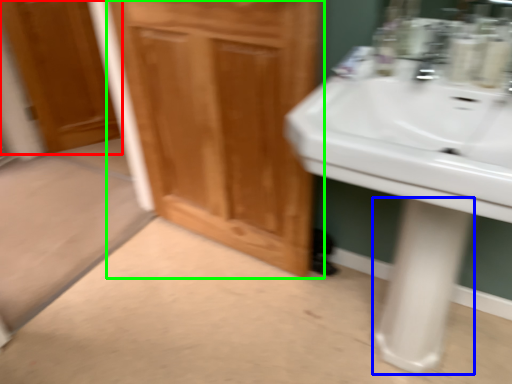
Question: Which is nearer to the door (highlighted by a red box)? pillar (highlighted by a blue box) or bathroom cabinet (highlighted by a green box).

Choices:
 (A) pillar
 (B) bathroom cabinet

Answer: (B)